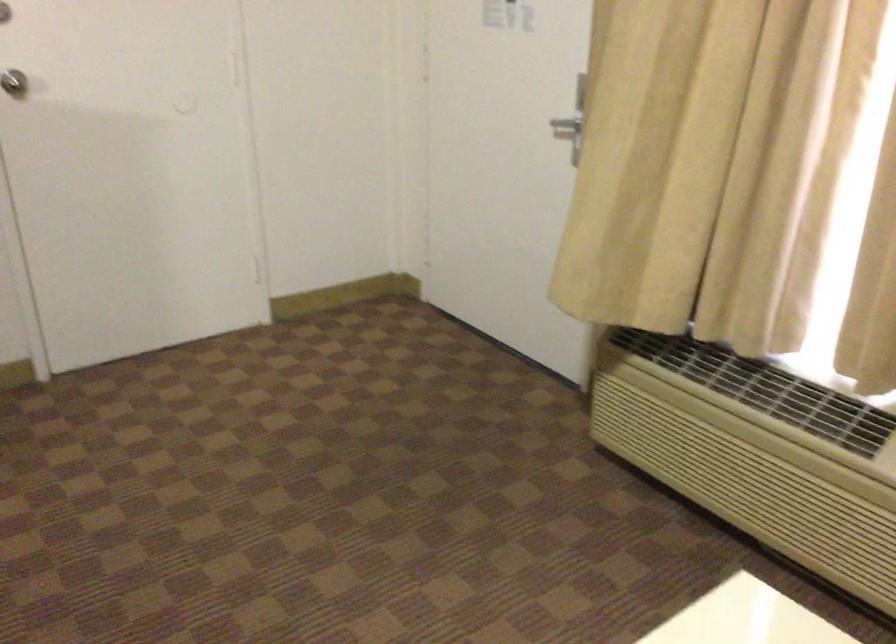
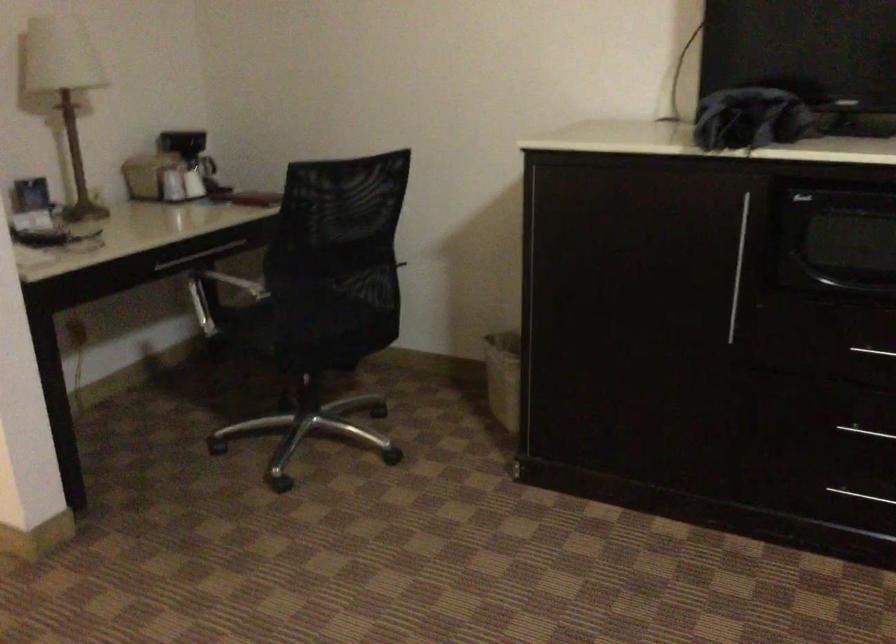
Question: Based on the continuous images, in which direction is the camera rotating? Reply with the corresponding letter.

Choices:
 (A) Left
 (B) Right
 (C) Up
 (D) Down

Answer: (A)